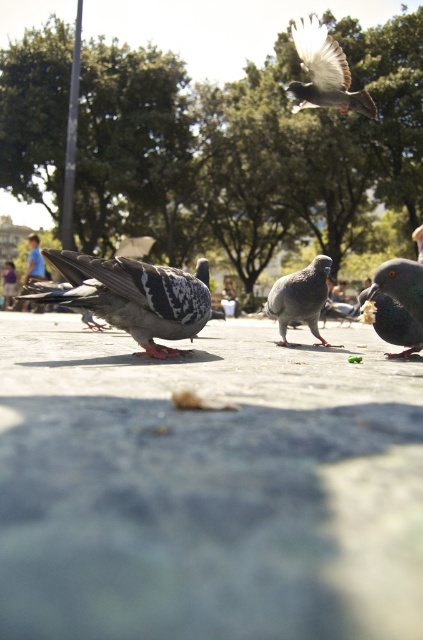
Does speckled feathered pigeon at center have a lesser width compared to speckled feathered bird at upper center?

Yes.

Between point (192, 317) and point (326, 33), which one is positioned behind?

Positioned behind is point (326, 33).

Find the location of a particular element. speckled feathered pigeon at center is located at coordinates (132, 296).

Find the location of a particular element. speckled feathered pigeon at center is located at coordinates (132, 296).

Does gray concrete pavement at center have a greater height compared to speckled feathered bird at upper center?

No, gray concrete pavement at center is not taller than speckled feathered bird at upper center.

Describe the element at coordinates (206, 488) in the screenshot. The width and height of the screenshot is (423, 640). I see `gray concrete pavement at center` at that location.

Is point (76, 440) farther from viewer compared to point (296, 49)?

No, it is in front of (296, 49).

This screenshot has width=423, height=640. What are the coordinates of `gray concrete pavement at center` in the screenshot? It's located at (206, 488).

Does speckled feathered bird at upper center appear over shiny dark gray pigeon at lower right?

Yes.

Can you confirm if speckled feathered bird at upper center is bigger than shiny dark gray pigeon at lower right?

Yes.

This screenshot has width=423, height=640. What do you see at coordinates (324, 72) in the screenshot? I see `speckled feathered bird at upper center` at bounding box center [324, 72].

This screenshot has height=640, width=423. I want to click on speckled feathered bird at upper center, so click(x=324, y=72).